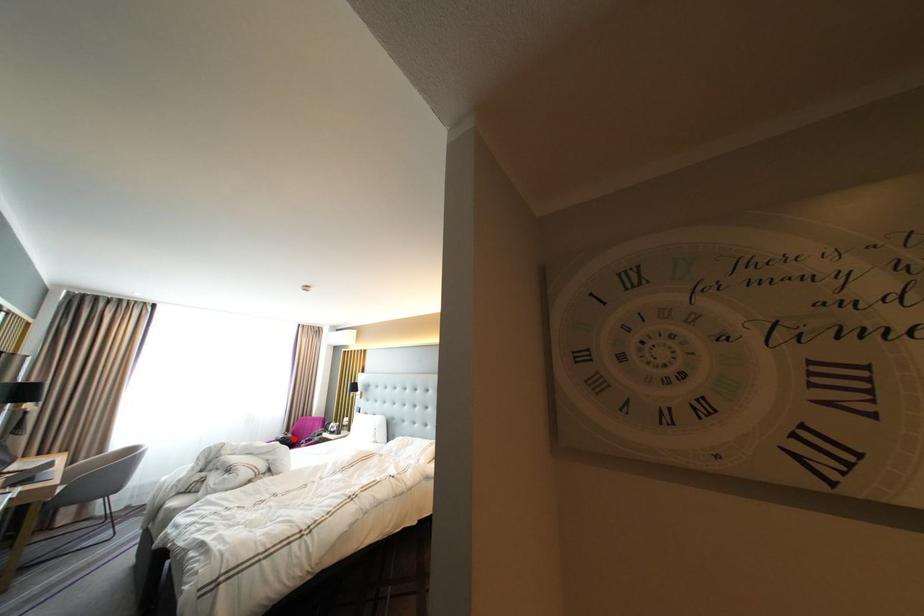
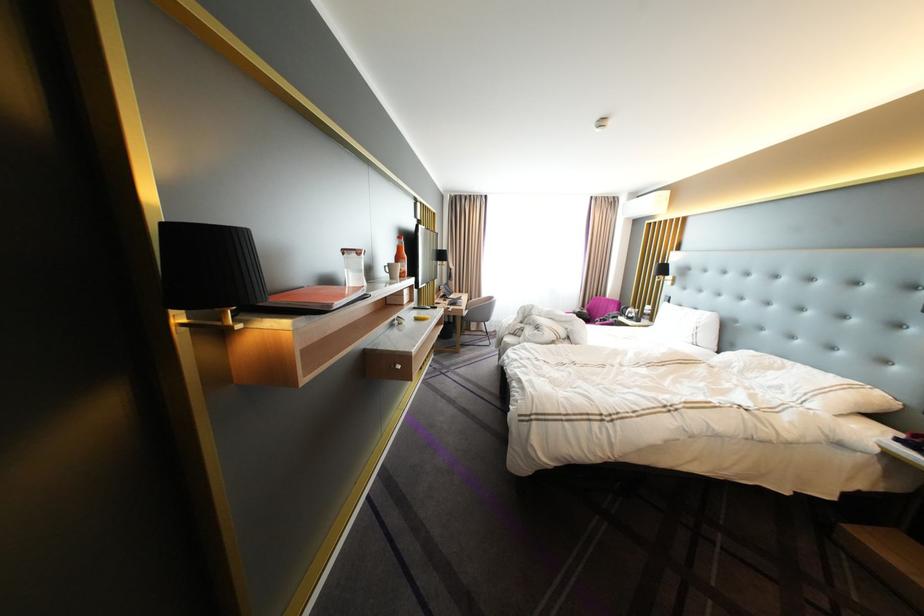
Find the pixel in the second image that matches the highlighted location in the first image.

(590, 313)